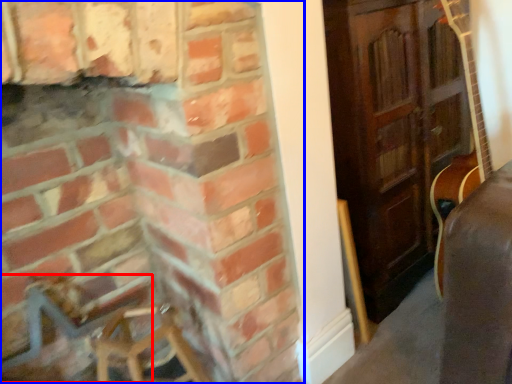
Question: Which object appears closest to the camera in this image, armchair (highlighted by a red box) or fireplace (highlighted by a blue box)?

Choices:
 (A) armchair
 (B) fireplace

Answer: (B)